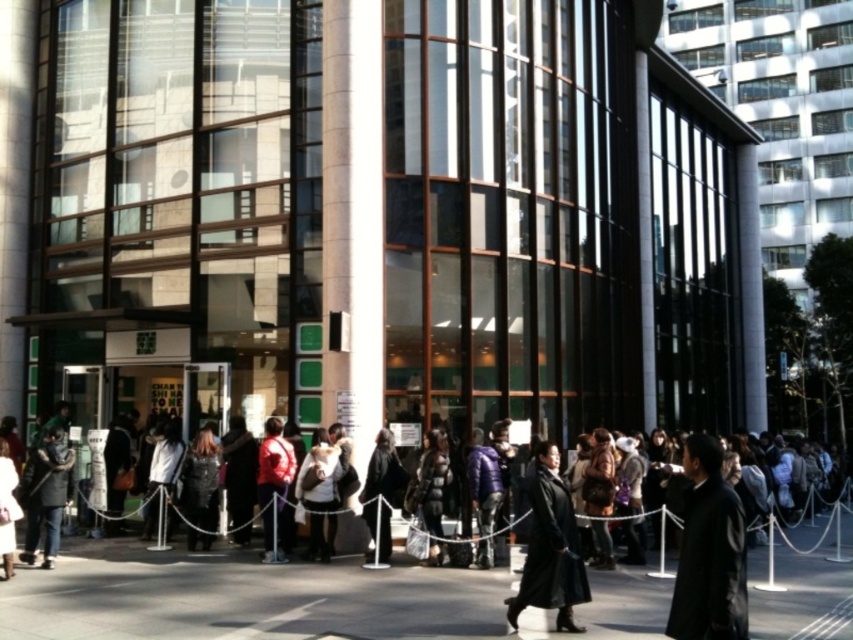
Question: Is black fabric coat at center smaller than white fabric jacket at center?

Choices:
 (A) no
 (B) yes

Answer: (B)

Question: Where is matte purple jacket at center located in relation to matte red jacket at center in the image?

Choices:
 (A) left
 (B) right

Answer: (B)

Question: Which object is farther from the camera taking this photo?

Choices:
 (A) velvet black coat at center
 (B) white fabric jacket at center

Answer: (A)

Question: Is white fur coat at center positioned at the back of black fabric coat at center?

Choices:
 (A) no
 (B) yes

Answer: (B)

Question: Which object appears farthest from the camera in this image?

Choices:
 (A) dark gray fabric coat at lower left
 (B) matte black coat at lower left
 (C) white fur coat at center
 (D) black puffer jacket at center

Answer: (C)

Question: Based on their relative distances, which object is farther from the black puffer jacket at center?

Choices:
 (A) dark gray fabric coat at lower left
 (B) white fur coat at center
 (C) matte black coat at lower left
 (D) white glossy pillar at center

Answer: (C)